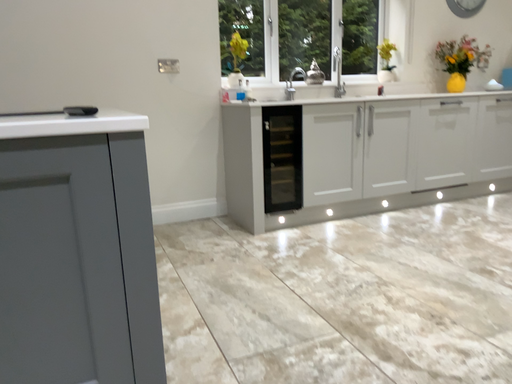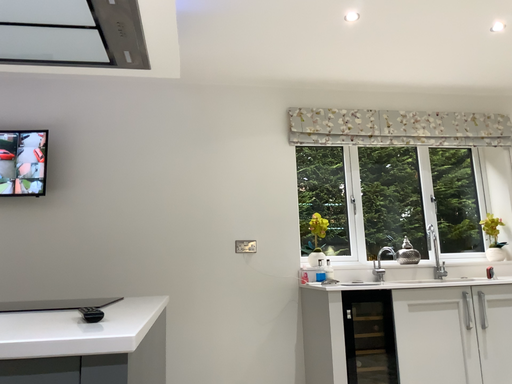
Question: How did the camera likely rotate when shooting the video?

Choices:
 (A) rotated upward
 (B) rotated downward

Answer: (A)